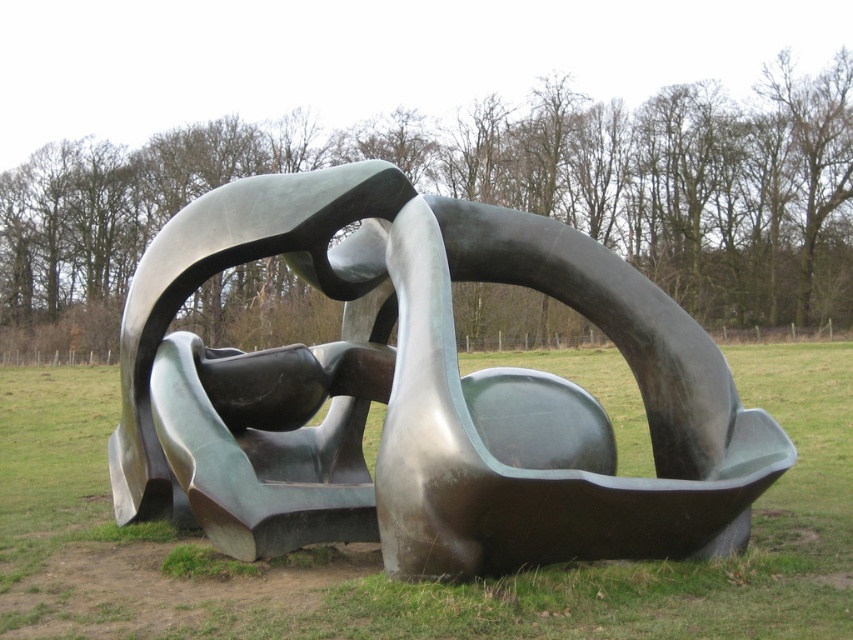
You are standing in front of the sculpture and want to locate two specific points on it. The first point is at coordinates point (379, 330) and the second is at point (100, 397). Which point is closer to you?

Point (379, 330) is in front of point (100, 397), so it is closer to you.